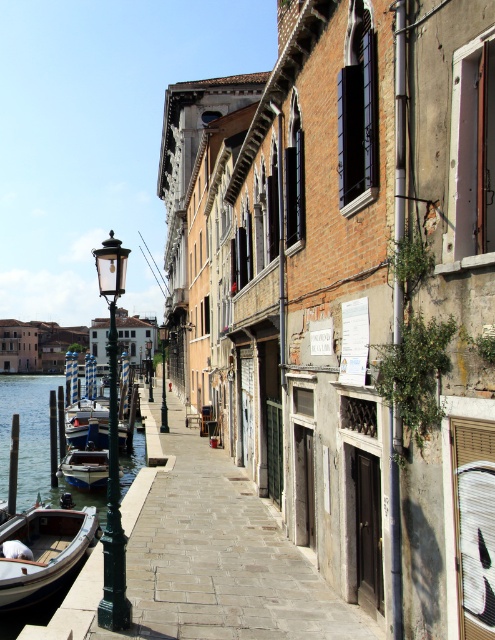
Is wooden boat at lower left above white glossy boat at lower left?

Incorrect, wooden boat at lower left is not positioned above white glossy boat at lower left.

The width and height of the screenshot is (495, 640). What are the coordinates of `wooden boat at lower left` in the screenshot? It's located at (43, 552).

Is clear water at dock left positioned at the back of wooden boat at lower left?

Yes, clear water at dock left is further from the viewer.

Is point (57, 493) farther from viewer compared to point (10, 529)?

That is True.

This screenshot has width=495, height=640. I want to click on clear water at dock left, so click(x=35, y=444).

Looking at this image, between green painted metal streetlamp at left and white glossy boat at lower left, which one is positioned higher?

green painted metal streetlamp at left is above.

Consider the image. Between green painted metal streetlamp at left and white glossy boat at lower left, which one appears on the left side from the viewer's perspective?

From the viewer's perspective, green painted metal streetlamp at left appears more on the left side.

This screenshot has width=495, height=640. What do you see at coordinates (112, 448) in the screenshot? I see `green painted metal streetlamp at left` at bounding box center [112, 448].

Locate an element on the screen. green painted metal streetlamp at left is located at coordinates (112, 448).